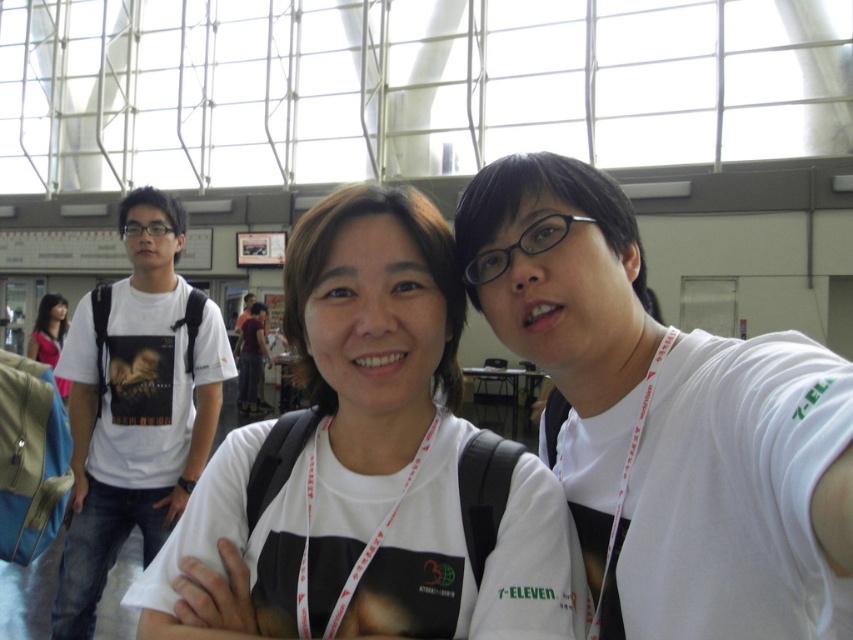
Based on the coordinates provided, which object in the scene is located at point [135,404]?

The point [135,404] corresponds to the white t shirt at left.